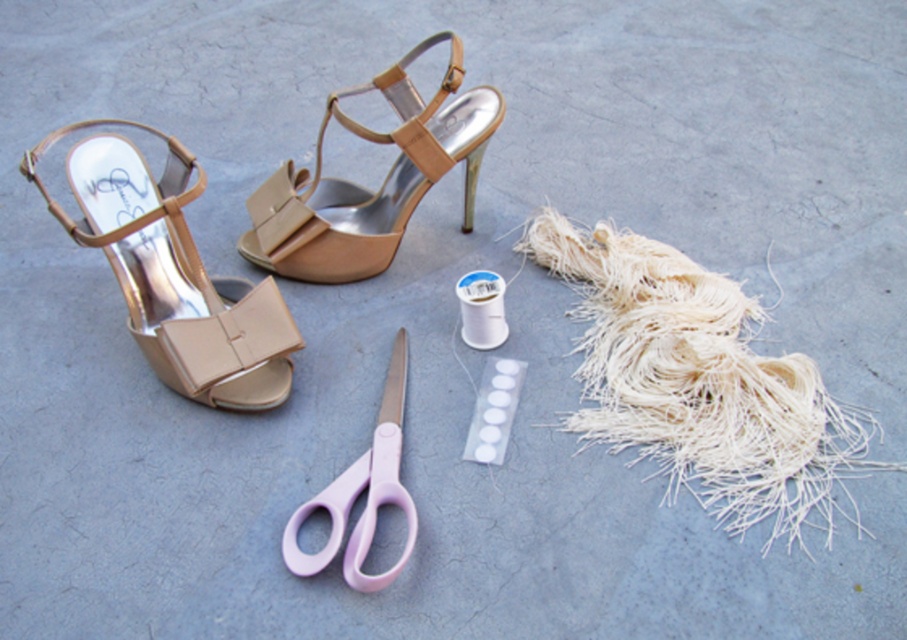
Question: Among these objects, which one is farthest from the camera?

Choices:
 (A) pink plastic scissors at center
 (B) white frayed yarn at lower right
 (C) matte beige sandal at center

Answer: (C)

Question: Is matte beige sandal at center smaller than pink plastic scissors at center?

Choices:
 (A) no
 (B) yes

Answer: (A)

Question: Considering the real-world distances, which object is closest to the white frayed yarn at lower right?

Choices:
 (A) matte beige sandal at left
 (B) pink plastic scissors at center
 (C) matte beige sandal at center

Answer: (B)

Question: Is white frayed yarn at lower right thinner than matte beige sandal at center?

Choices:
 (A) no
 (B) yes

Answer: (A)

Question: Can you confirm if white frayed yarn at lower right is positioned above pink plastic scissors at center?

Choices:
 (A) yes
 (B) no

Answer: (A)

Question: Estimate the real-world distances between objects in this image. Which object is farther from the matte beige sandal at left?

Choices:
 (A) white frayed yarn at lower right
 (B) pink plastic scissors at center
 (C) matte beige sandal at center

Answer: (A)